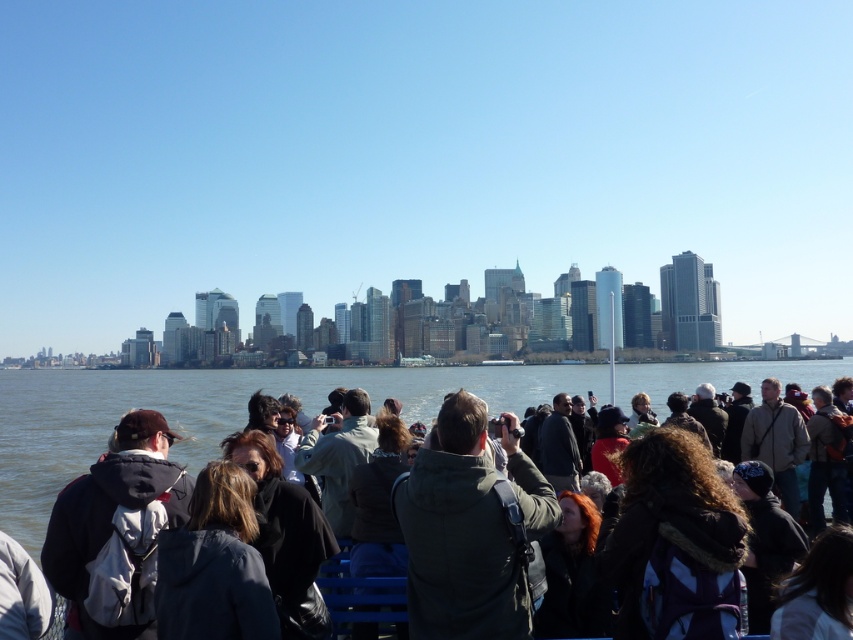
Question: Which object appears closest to the camera in this image?

Choices:
 (A) white plastic boat at center
 (B) dark blue jacket at lower left

Answer: (B)

Question: Can you confirm if dark gray hoodie at left is positioned above dark brown leather jacket at center?

Choices:
 (A) yes
 (B) no

Answer: (B)

Question: Is dark blue jacket at lower left to the right of white plastic boat at center from the viewer's perspective?

Choices:
 (A) yes
 (B) no

Answer: (B)

Question: Which object is closer to the camera taking this photo?

Choices:
 (A) brown water at center
 (B) dark brown leather jacket at center

Answer: (B)

Question: Among these points, which one is nearest to the camera?

Choices:
 (A) (651, 472)
 (B) (107, 618)
 (C) (778, 634)
 (D) (325, 637)

Answer: (C)

Question: Observing the image, what is the correct spatial positioning of dark blue jacket at lower left in reference to white plastic boat at center?

Choices:
 (A) right
 (B) left

Answer: (B)